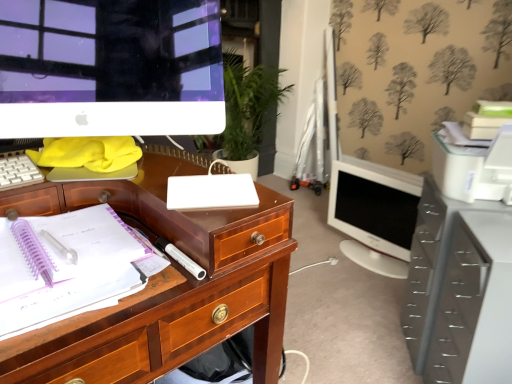
Question: From the image's perspective, does translucent plastic pen at left, the first office supplies in the bottom-to-top sequence, appear higher than white glossy monitor at center right, the second computer monitor in the front-to-back sequence?

Choices:
 (A) yes
 (B) no

Answer: (B)

Question: Can we say translucent plastic pen at left, which ranks as the 2th office supplies in top-to-bottom order, lies outside white glossy monitor at center right, which is counted as the 2th computer monitor, starting from the left?

Choices:
 (A) no
 (B) yes

Answer: (B)

Question: Considering the relative sizes of translucent plastic pen at left, marked as the 1th office supplies in a left-to-right arrangement, and white glossy monitor at center right, which is counted as the 2th computer monitor, starting from the left, in the image provided, is translucent plastic pen at left, marked as the 1th office supplies in a left-to-right arrangement, thinner than white glossy monitor at center right, which is counted as the 2th computer monitor, starting from the left,?

Choices:
 (A) no
 (B) yes

Answer: (A)

Question: Does translucent plastic pen at left, which ranks as the 2th office supplies in top-to-bottom order, lie in front of white glossy monitor at center right, the 1th computer monitor from the back?

Choices:
 (A) yes
 (B) no

Answer: (A)

Question: Is translucent plastic pen at left, which ranks as the 2th office supplies in top-to-bottom order, smaller than white glossy monitor at center right, the second computer monitor in the front-to-back sequence?

Choices:
 (A) yes
 (B) no

Answer: (A)

Question: Is white matte notebook at center, the second office supplies when ordered from bottom to top, bigger or smaller than white plastic keyboard at left?

Choices:
 (A) small
 (B) big

Answer: (A)

Question: From a real-world perspective, relative to white plastic keyboard at left, is white matte notebook at center, the 2th office supplies positioned from the left, vertically above or below?

Choices:
 (A) above
 (B) below

Answer: (B)

Question: Is white matte notebook at center, the first office supplies when ordered from right to left, inside or outside of white plastic keyboard at left?

Choices:
 (A) outside
 (B) inside

Answer: (A)

Question: Would you say white matte notebook at center, the 2th office supplies positioned from the left, is to the left or to the right of white plastic keyboard at left in the picture?

Choices:
 (A) right
 (B) left

Answer: (A)

Question: Is white glossy monitor at center right, which is counted as the 2th computer monitor, starting from the left, situated inside metallic gray file cabinet at lower right or outside?

Choices:
 (A) inside
 (B) outside

Answer: (B)

Question: From a real-world perspective, is white glossy monitor at center right, the second computer monitor in the front-to-back sequence, above or below metallic gray file cabinet at lower right?

Choices:
 (A) above
 (B) below

Answer: (B)

Question: Considering the positions of white glossy monitor at center right, which is the 1th computer monitor from right to left, and metallic gray file cabinet at lower right in the image, is white glossy monitor at center right, which is the 1th computer monitor from right to left, wider or thinner than metallic gray file cabinet at lower right?

Choices:
 (A) wide
 (B) thin

Answer: (B)

Question: Is white glossy monitor at center right, the second computer monitor in the front-to-back sequence, to the left or to the right of metallic gray file cabinet at lower right in the image?

Choices:
 (A) left
 (B) right

Answer: (A)

Question: Is white plastic keyboard at left in front of or behind translucent plastic pen at left, the first office supplies in the bottom-to-top sequence, in the image?

Choices:
 (A) behind
 (B) front

Answer: (A)

Question: Would you say white plastic keyboard at left is inside or outside translucent plastic pen at left, the second office supplies from the right?

Choices:
 (A) outside
 (B) inside

Answer: (A)